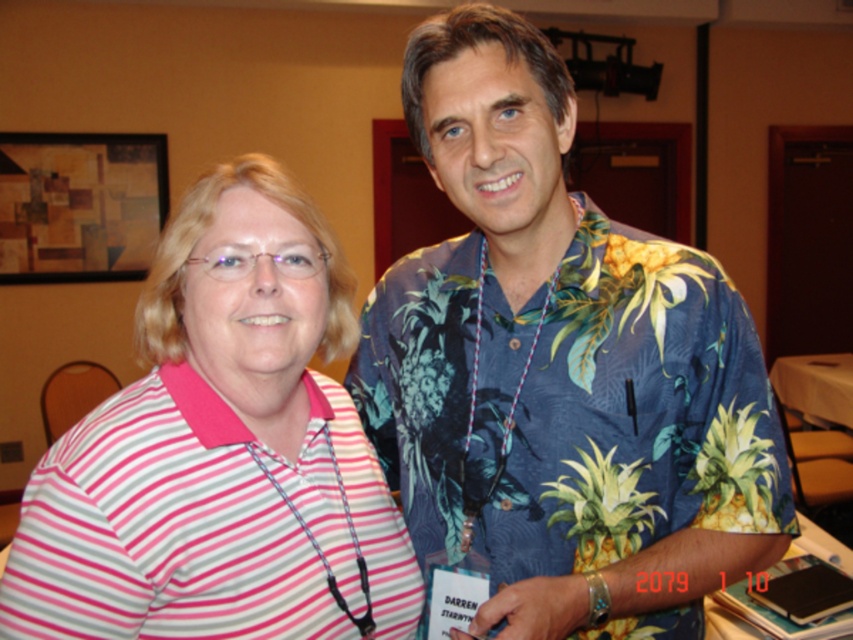
You are trying to decide which shirt to wear for a casual event. Both the blue floral shirt at center and the pink striped shirt at left are options. Based on their sizes, which one would you choose if you prefer a more oversized look?

The blue floral shirt at center is larger in size than the pink striped shirt at left, so if you prefer an oversized look, you should choose the blue floral shirt at center.

From the picture: You are standing in a room and want to hand a document to the person wearing the blue floral shirt at center. You have a 1.2 meter long ruler. Can you reach them without moving from your current position?

The blue floral shirt at center and viewer are 79.44 centimeters apart from each other. Since the ruler is 1.2 meters long, which is longer than the distance between you and the person, you can reach them without moving.

You are trying to decide which shirt to wear for a casual event. Both the blue floral shirt at center and the pink striped shirt at left are options. Based on their sizes, which one is wider?

The blue floral shirt at center is wider than the pink striped shirt at left.